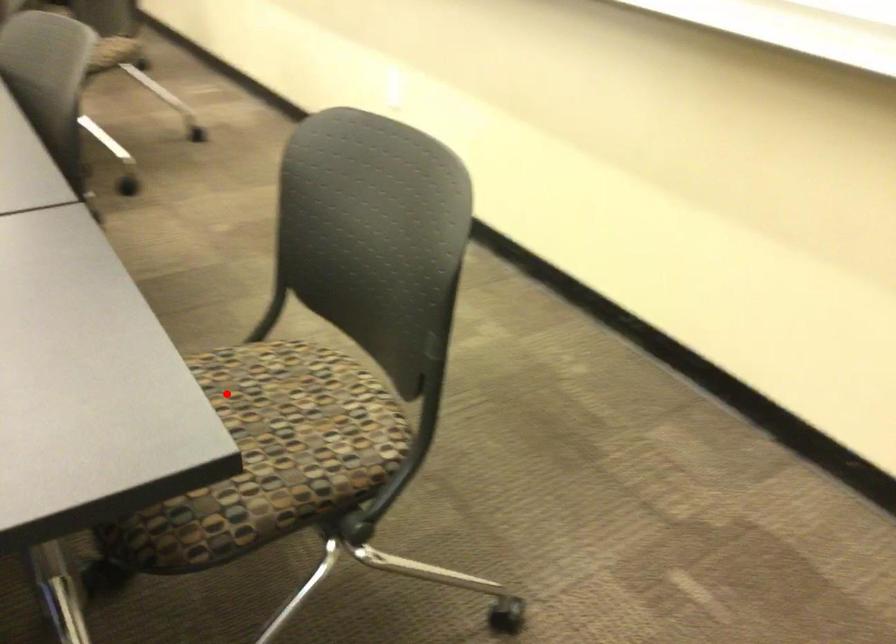
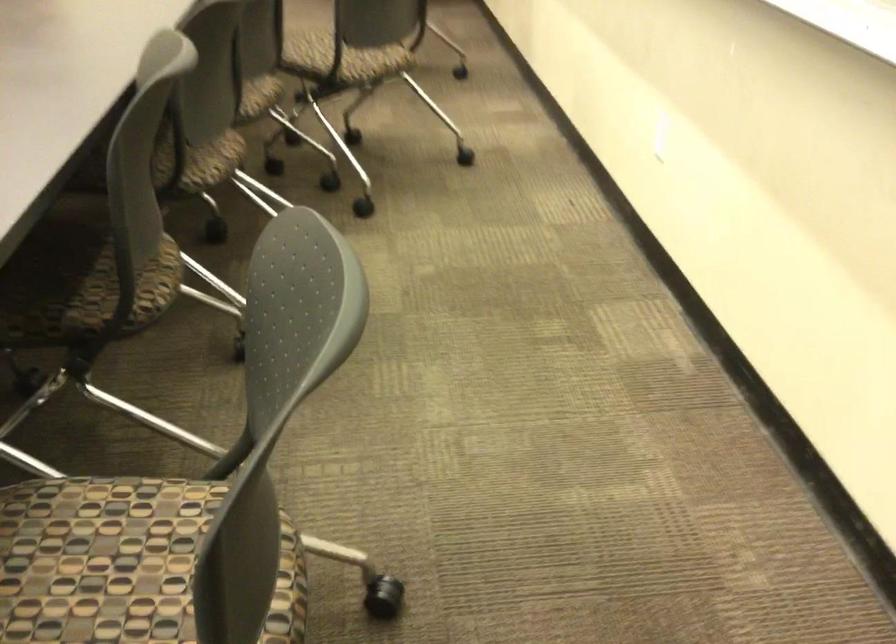
In the second image, find the point that corresponds to the highlighted location in the first image.

(99, 556)